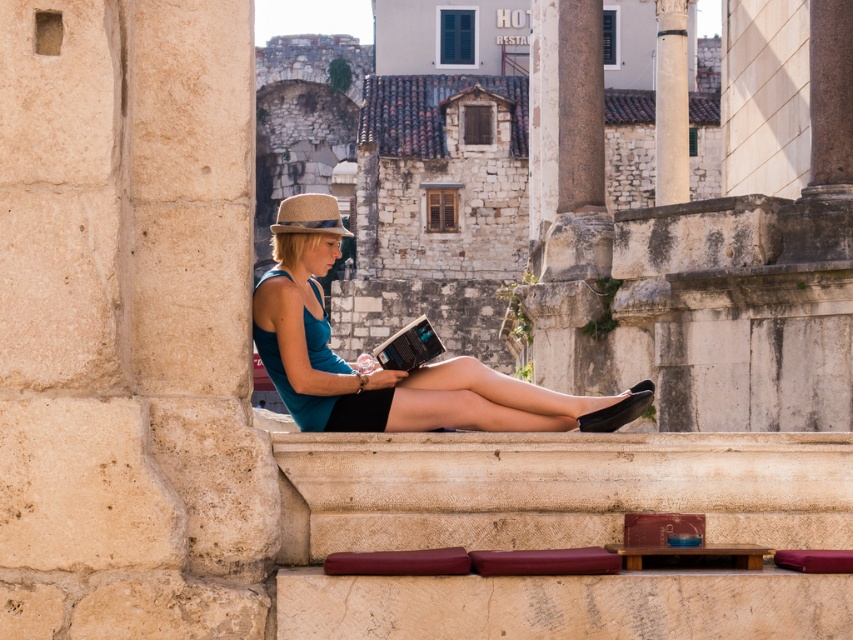
Who is more distant from viewer, (277, 308) or (549, 195)?

Positioned behind is point (549, 195).

Is matte blue dress at center above smooth stone pillar at center?

Actually, matte blue dress at center is below smooth stone pillar at center.

Is point (532, 397) positioned after point (552, 147)?

No, (532, 397) is closer to viewer.

You are a GUI agent. You are given a task and a screenshot of the screen. Output one action in this format:
    pyautogui.click(x=<x>, y=<y>)
    Task: Click on the matte blue dress at center
    The width and height of the screenshot is (853, 640).
    Given the screenshot: What is the action you would take?
    point(397,369)

Is point (281, 232) positioned before point (294, 216)?

No, it is behind (294, 216).

Can you confirm if matte blue dress at center is bigger than brown woven hat at center?

Actually, matte blue dress at center might be smaller than brown woven hat at center.

The height and width of the screenshot is (640, 853). Find the location of `matte blue dress at center`. matte blue dress at center is located at coordinates (397, 369).

The height and width of the screenshot is (640, 853). What are the coordinates of `matte blue dress at center` in the screenshot? It's located at (397, 369).

Measure the distance between matte blue dress at center and teal fabric dress at center.

The distance of matte blue dress at center from teal fabric dress at center is 1.80 meters.

Looking at this image, is matte blue dress at center to the left of teal fabric dress at center from the viewer's perspective?

No, matte blue dress at center is not to the left of teal fabric dress at center.

What do you see at coordinates (397, 369) in the screenshot?
I see `matte blue dress at center` at bounding box center [397, 369].

This screenshot has width=853, height=640. I want to click on matte blue dress at center, so click(397, 369).